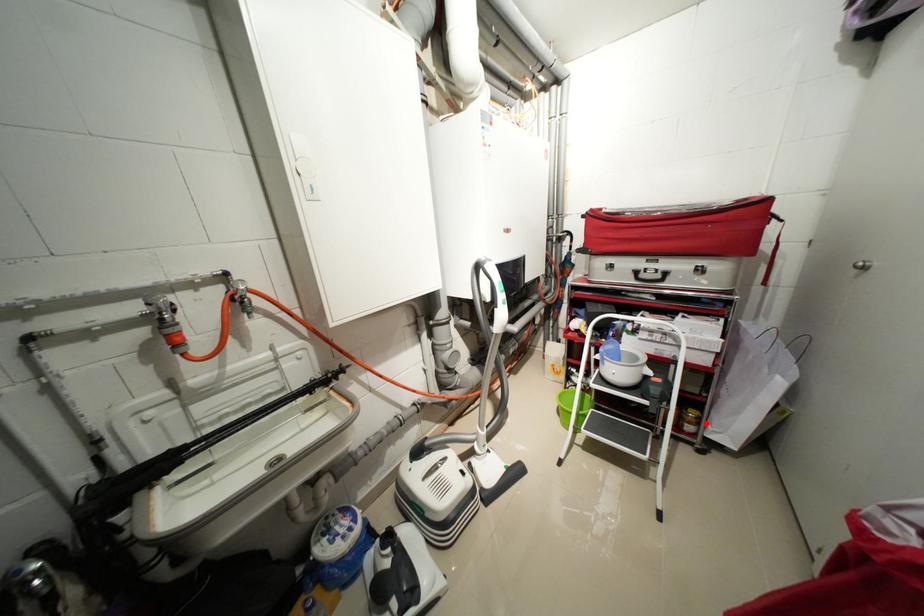
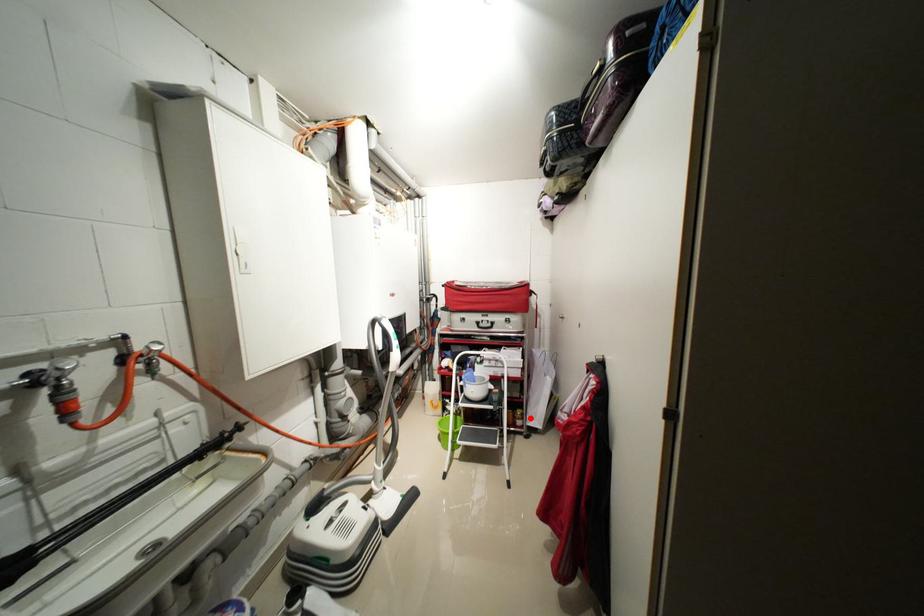
Looking at this image, I am providing you with two images of the same scene from different viewpoints. A red point is marked on the first image and another point is marked on the second image. Is the red point in image1 aligned with the point shown in image2?

Yes